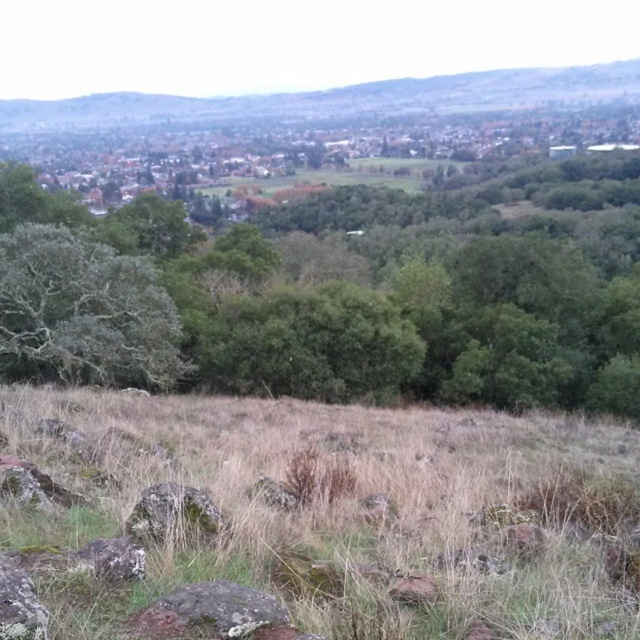
Is point (42, 316) positioned behind point (236, 616)?

Yes, point (42, 316) is behind point (236, 616).

Between green rough bark tree at left and mossy rock at lower center, which one has more height?

With more height is green rough bark tree at left.

Find the location of a particular element. green rough bark tree at left is located at coordinates (83, 312).

Is point (500, 100) farther from camera compared to point (33, 596)?

Yes, it is.

Does green grassy hillside at upper center have a larger size compared to mossy rock at lower left?

Yes, green grassy hillside at upper center is bigger than mossy rock at lower left.

Which is behind, point (490, 109) or point (10, 627)?

The point (490, 109) is more distant.

I want to click on green grassy hillside at upper center, so click(337, 100).

Does gray rough rock at lower left appear on the left side of green mossy rock at lower left?

In fact, gray rough rock at lower left is to the right of green mossy rock at lower left.

The height and width of the screenshot is (640, 640). What do you see at coordinates (109, 557) in the screenshot? I see `gray rough rock at lower left` at bounding box center [109, 557].

Where is `gray rough rock at lower left`? gray rough rock at lower left is located at coordinates (109, 557).

Where is `gray rough rock at lower left`? gray rough rock at lower left is located at coordinates (109, 557).